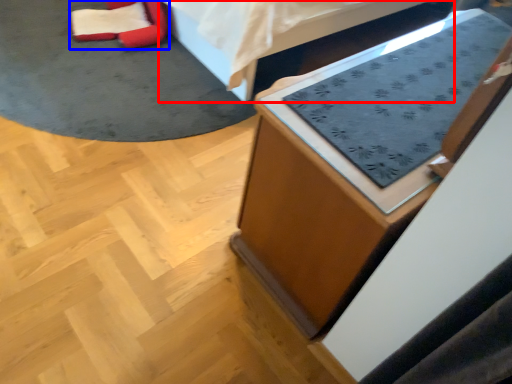
Question: Which object is closer to the camera taking this photo, furniture (highlighted by a red box) or bean bag chair (highlighted by a blue box)?

Choices:
 (A) furniture
 (B) bean bag chair

Answer: (A)